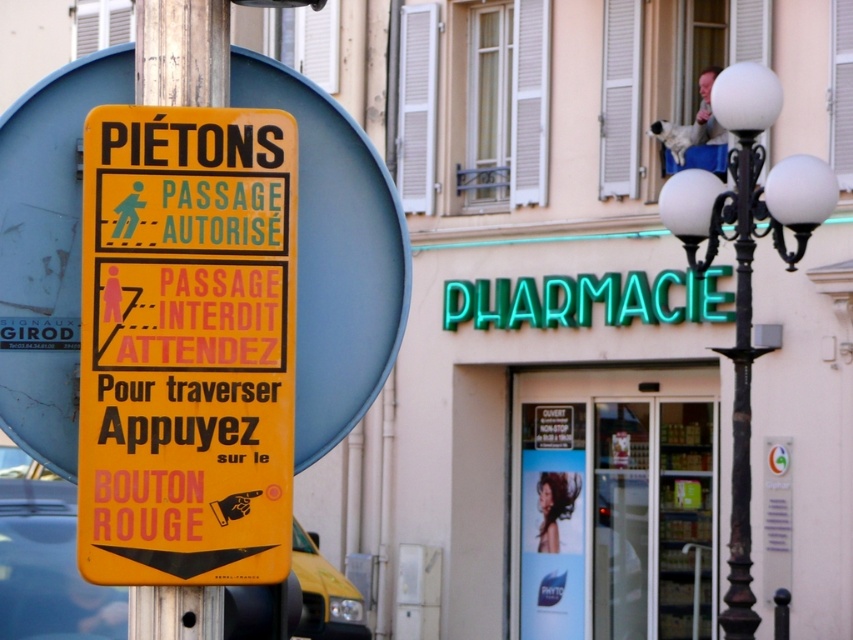
You are a pedestrian standing at the yellow pedestrian crossing sign. You see two points marked on the ground, one at point (184, 541) and the other at point (57, 134). Which point is closer to you?

Point (184, 541) is in front of point (57, 134), so it is closer to you.

You are a visitor at this location and need to enter the transparent glass door at center. However, the yellow matte sign at left is currently lit with the message

The yellow matte sign at left indicates that passage is prohibited when it is not illuminated. Since the sign is currently lit with

You are a pedestrian standing in front of the yellow pedestrian crossing sign. You see a transparent glass door at center and a metallic parking sign at center. Which object is to the left of the other?

The transparent glass door at center is positioned on the left side of metallic parking sign at center.